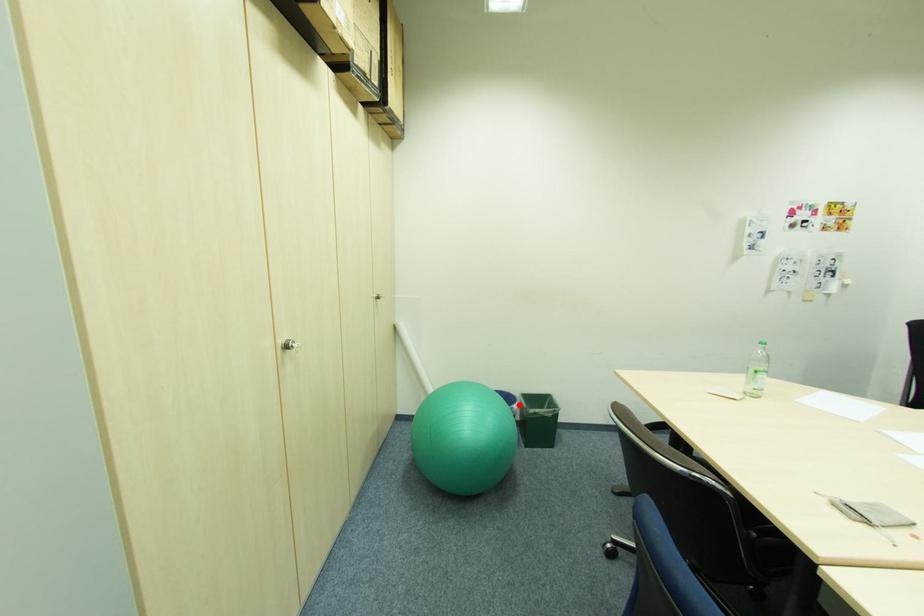
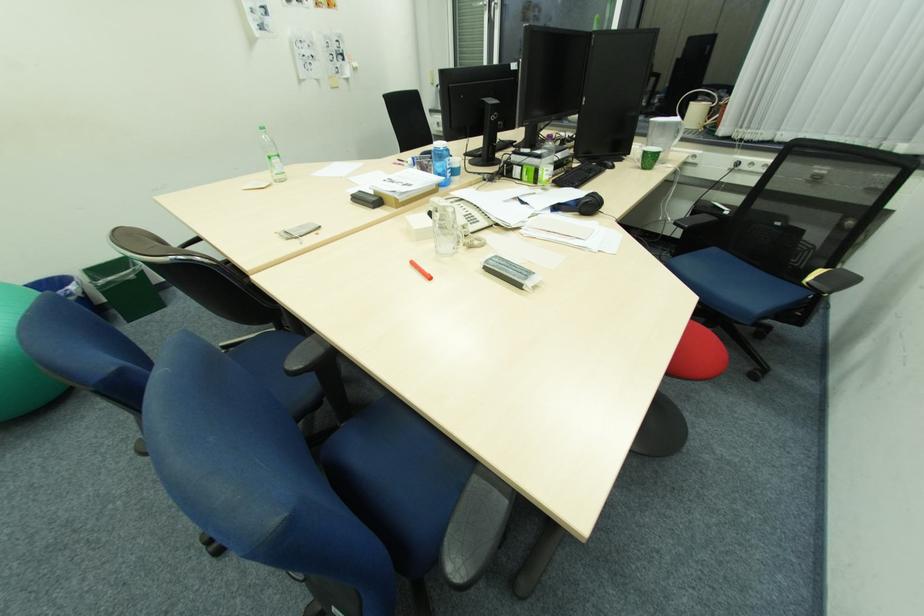
Where in the second image is the point corresponding to the highlighted location from the first image?

(73, 286)